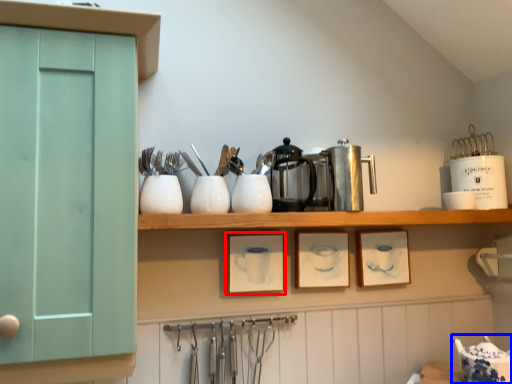
Question: Among these objects, which one is nearest to the camera, picture frame (highlighted by a red box) or tableware (highlighted by a blue box)?

Choices:
 (A) picture frame
 (B) tableware

Answer: (B)